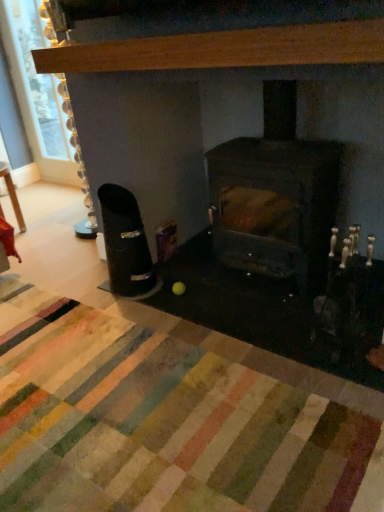
Locate an element on the screen. vacant area that is in front of black plastic ashtray at left is located at coordinates (125, 313).